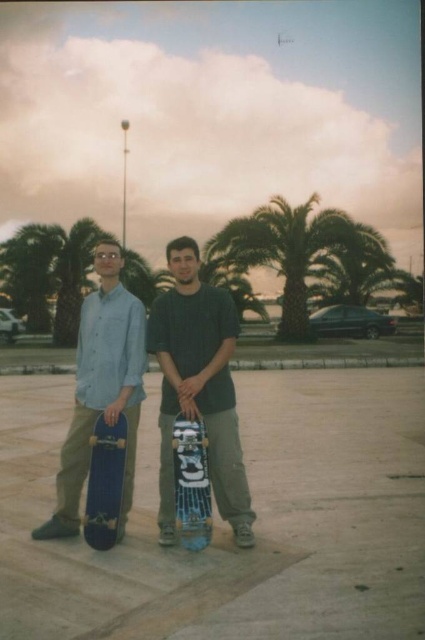
Question: Is matte black skateboard at center wider than blue glossy skateboard at center?

Choices:
 (A) no
 (B) yes

Answer: (B)

Question: Which of the following is the farthest from the observer?

Choices:
 (A) (257, 220)
 (B) (197, 316)
 (C) (118, 492)
 (D) (61, 513)

Answer: (A)

Question: Does green leafy palm tree at center come in front of blue matte skateboard at left?

Choices:
 (A) yes
 (B) no

Answer: (B)

Question: Does matte blue skateboard at left appear on the left side of green leafy palm tree at center?

Choices:
 (A) yes
 (B) no

Answer: (A)

Question: Which object is farther from the camera taking this photo?

Choices:
 (A) blue glossy skateboard at center
 (B) blue matte skateboard at left
 (C) matte black skateboard at center

Answer: (C)

Question: Which is farther from the green leafy palm tree at center?

Choices:
 (A) matte black skateboard at center
 (B) blue glossy skateboard at center
 (C) matte blue skateboard at left
 (D) blue matte skateboard at left

Answer: (D)